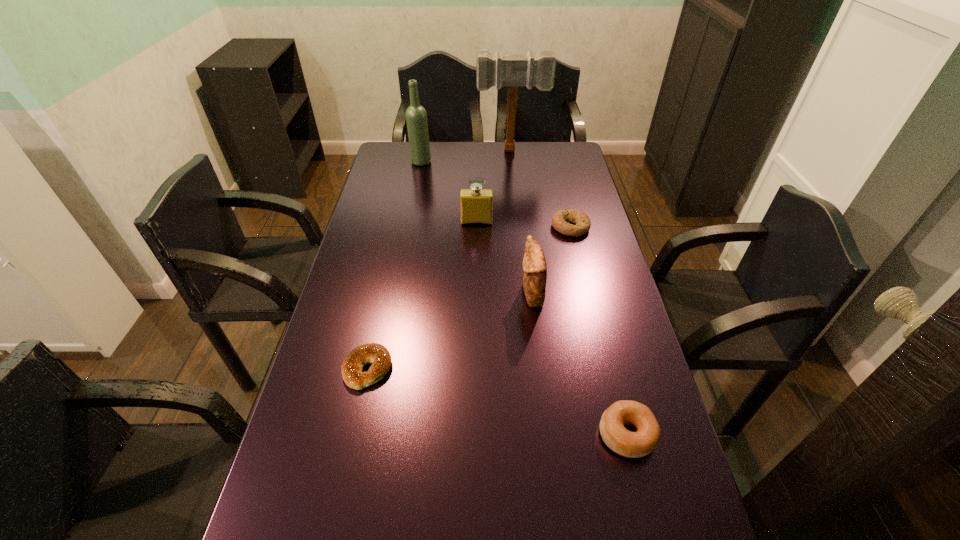
Where is `mallet that is at the far edge`? mallet that is at the far edge is located at coordinates (512, 70).

In order to click on wine bottle that is at the far edge in this screenshot , I will do `click(416, 117)`.

Identify the location of wine bottle positioned at the left edge. Image resolution: width=960 pixels, height=540 pixels. (416, 117).

Find the location of `bagel situated at the left edge`. bagel situated at the left edge is located at coordinates (352, 367).

Identify the location of mallet that is at the right edge. The image size is (960, 540). (512, 70).

Find the location of a particular element. The width and height of the screenshot is (960, 540). object located at the far left corner is located at coordinates (416, 117).

Locate an element on the screen. The image size is (960, 540). object located in the far right corner section of the desktop is located at coordinates (512, 70).

At what (x,y) coordinates should I click in order to perform the action: click on blank space at the far edge of the desktop. Please return your answer as a coordinate pair (x, y). The height and width of the screenshot is (540, 960). Looking at the image, I should click on (533, 142).

The height and width of the screenshot is (540, 960). I want to click on vacant space at the left edge of the desktop, so click(x=363, y=249).

Image resolution: width=960 pixels, height=540 pixels. I want to click on free space at the right edge of the desktop, so click(x=594, y=342).